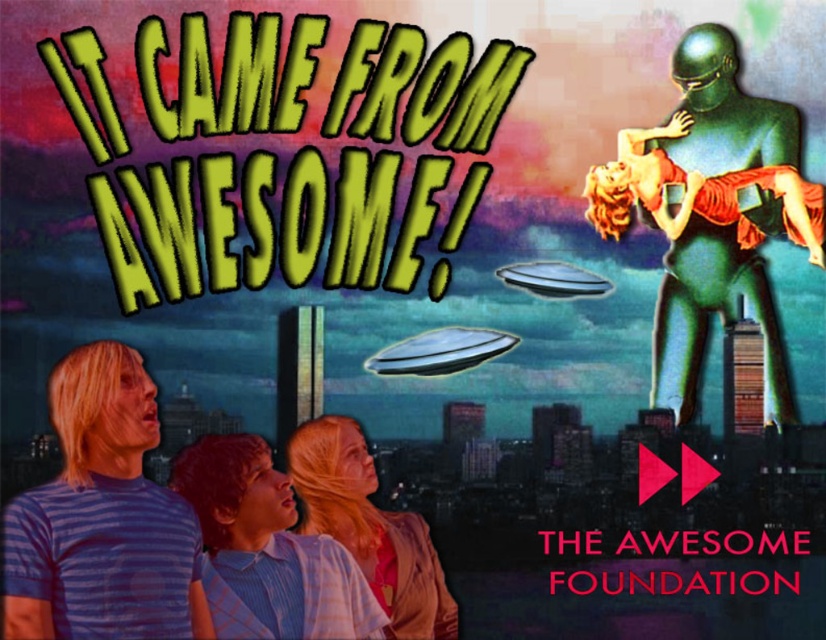
Question: From the image, what is the correct spatial relationship of green metallic alien at upper right in relation to purple striped t-shirt at lower left?

Choices:
 (A) below
 (B) above

Answer: (B)

Question: Based on their relative distances, which object is farther from the purple striped t-shirt at lower left?

Choices:
 (A) light blue striped shirt at lower left
 (B) blonde hair at center

Answer: (B)

Question: Which of the following is the closest to the observer?

Choices:
 (A) blonde hair at center
 (B) purple striped t-shirt at lower left
 (C) light blue striped shirt at lower left
 (D) green metallic alien at upper right

Answer: (B)

Question: Is purple striped t-shirt at lower left to the right of light blue striped shirt at lower left from the viewer's perspective?

Choices:
 (A) no
 (B) yes

Answer: (A)

Question: Does green metallic alien at upper right come in front of purple striped t-shirt at lower left?

Choices:
 (A) no
 (B) yes

Answer: (A)

Question: Which point is closer to the camera?

Choices:
 (A) purple striped t-shirt at lower left
 (B) light blue striped shirt at lower left
 (C) green metallic alien at upper right
 (D) blonde hair at center

Answer: (A)